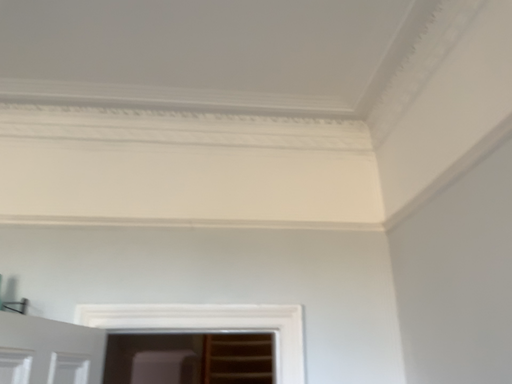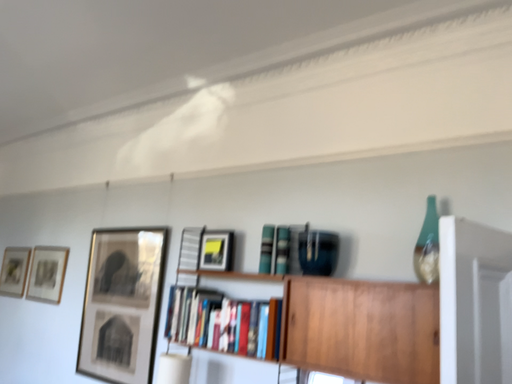
Question: Which way did the camera rotate in the video?

Choices:
 (A) rotated upward
 (B) rotated downward

Answer: (B)